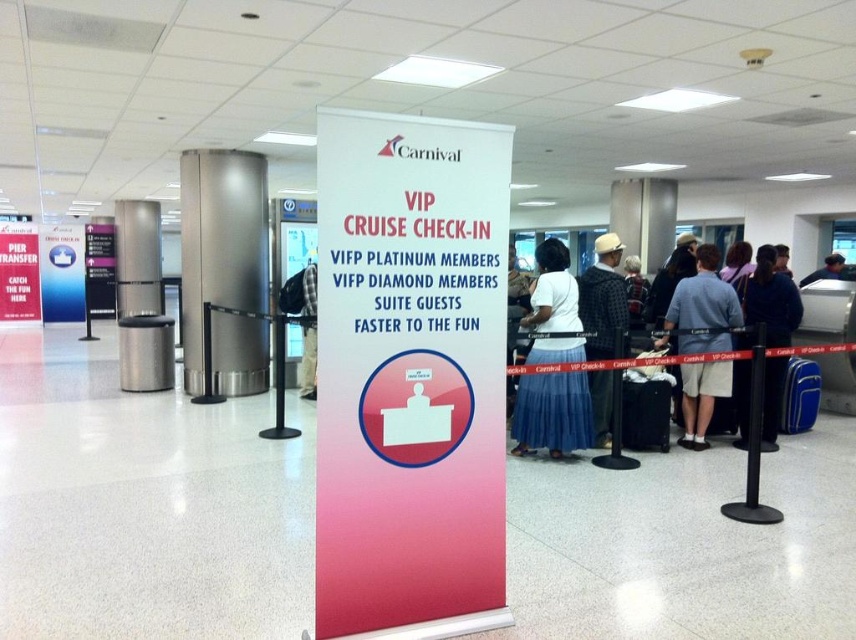
Between gray cotton shirt at center and blue fabric suitcase at right, which one appears on the right side from the viewer's perspective?

blue fabric suitcase at right is more to the right.

Who is taller, gray cotton shirt at center or blue fabric suitcase at right?

gray cotton shirt at center

Is point (734, 294) positioned before point (783, 404)?

Yes, it is in front of point (783, 404).

Where is `gray cotton shirt at center`? gray cotton shirt at center is located at coordinates (702, 308).

Can you confirm if gray cotton shirt at center is smaller than white paper sign at center?

No.

You are a GUI agent. You are given a task and a screenshot of the screen. Output one action in this format:
    pyautogui.click(x=<x>, y=<y>)
    Task: Click on the gray cotton shirt at center
    
    Given the screenshot: What is the action you would take?
    pyautogui.click(x=702, y=308)

The image size is (856, 640). I want to click on gray cotton shirt at center, so click(702, 308).

Between dark blue sweater at center right and plaid fabric shirt at center, which one is positioned higher?

plaid fabric shirt at center is higher up.

Between point (744, 362) and point (301, 392), which one is positioned in front?

Point (744, 362) is in front.

I want to click on dark blue sweater at center right, so click(x=768, y=301).